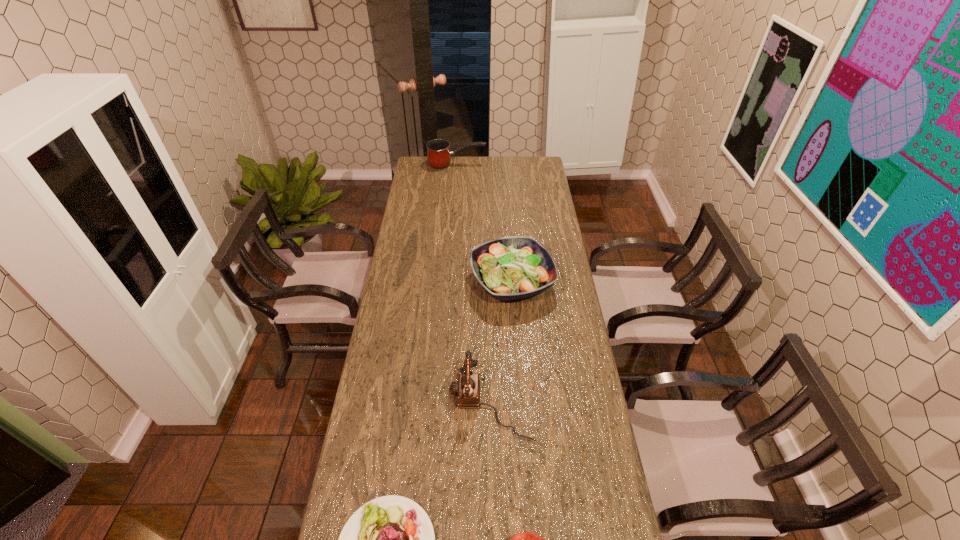
Locate an element on the screen. the farthest object is located at coordinates [438, 154].

Find the location of a particular element. The height and width of the screenshot is (540, 960). the farther salad plate is located at coordinates (508, 268).

Identify the location of the right salad plate. (508, 268).

In order to click on the third nearest object in this screenshot , I will do `click(467, 389)`.

What are the coordinates of `free space located 0.120m on the handle side of the saucepan` in the screenshot? It's located at (507, 165).

Where is `vacant space positioned 0.300m on the front of the second farthest object`? This screenshot has height=540, width=960. vacant space positioned 0.300m on the front of the second farthest object is located at coordinates (519, 380).

The image size is (960, 540). What are the coordinates of `vacant space positioned 0.120m on the dial of the third farthest object` in the screenshot? It's located at (412, 402).

Where is `vacant space located 0.220m on the dial of the third farthest object`? This screenshot has width=960, height=540. vacant space located 0.220m on the dial of the third farthest object is located at coordinates (380, 402).

Find the location of a particular element. free space located on the dial of the third farthest object is located at coordinates (387, 402).

Identify the location of object that is at the far edge. Image resolution: width=960 pixels, height=540 pixels. (x=438, y=154).